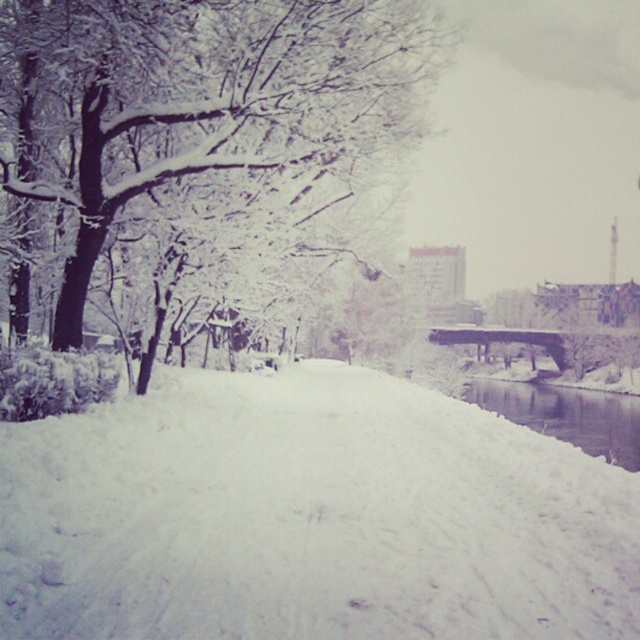
Which is below, snow-covered branches at upper left or clear water at lower right?

clear water at lower right

Between snow-covered branches at upper left and clear water at lower right, which one is positioned higher?

snow-covered branches at upper left

Between point (278, 65) and point (604, 413), which one is positioned behind?

The point (604, 413) is behind.

In order to click on snow-covered branches at upper left in this screenshot , I will do `click(220, 100)`.

Is white fluffy snow at center to the right of snow-covered branches at upper left from the viewer's perspective?

Correct, you'll find white fluffy snow at center to the right of snow-covered branches at upper left.

Which is more to the right, white fluffy snow at center or snow-covered branches at upper left?

white fluffy snow at center is more to the right.

Measure the distance between point (396,579) and camera.

Point (396,579) is 19.60 feet from camera.

Where is `white fluffy snow at center`? This screenshot has width=640, height=640. white fluffy snow at center is located at coordinates (308, 516).

Can you confirm if white fluffy snow at center is positioned to the left of clear water at lower right?

Correct, you'll find white fluffy snow at center to the left of clear water at lower right.

Can you confirm if white fluffy snow at center is positioned to the right of clear water at lower right?

Incorrect, white fluffy snow at center is not on the right side of clear water at lower right.

Is point (67, 632) in front of point (564, 388)?

Yes, point (67, 632) is closer to viewer.

Identify the location of white fluffy snow at center. The height and width of the screenshot is (640, 640). (308, 516).